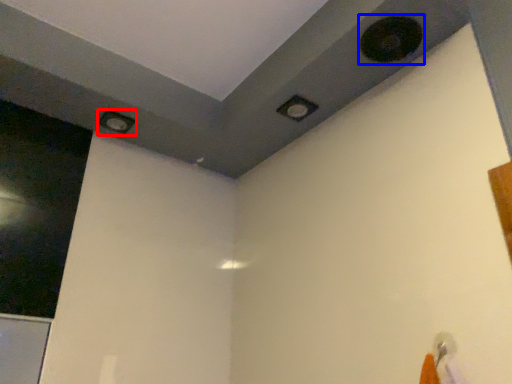
Question: Which point is further to the camera, hole (highlighted by a red box) or hole (highlighted by a blue box)?

Choices:
 (A) hole
 (B) hole

Answer: (A)